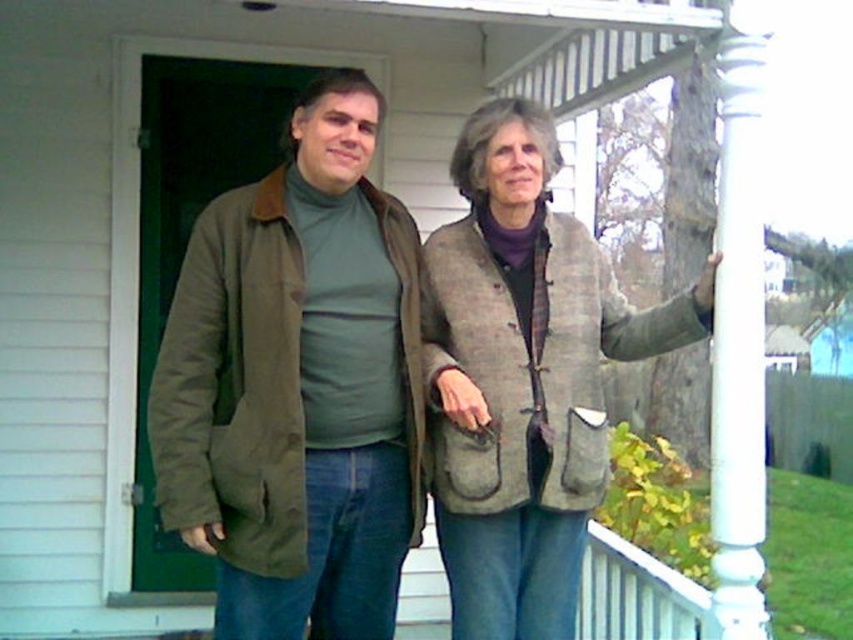
Between matte olive-green jacket at center and gray woolen vest at center, which one has less height?

With less height is gray woolen vest at center.

Who is more forward, (277, 624) or (563, 220)?

Positioned in front is point (277, 624).

The height and width of the screenshot is (640, 853). I want to click on matte olive-green jacket at center, so click(299, 385).

Between gray woolen vest at center and white glossy column at right, which one has less height?

gray woolen vest at center is shorter.

Who is taller, gray woolen vest at center or white glossy column at right?

white glossy column at right is taller.

The image size is (853, 640). I want to click on gray woolen vest at center, so click(x=524, y=376).

Can you confirm if matte olive-green jacket at center is positioned to the right of white glossy column at right?

Incorrect, matte olive-green jacket at center is not on the right side of white glossy column at right.

Which is behind, point (312, 115) or point (730, 113)?

The point (312, 115) is more distant.

Which is behind, point (350, 99) or point (722, 209)?

The point (350, 99) is behind.

Find the location of a particular element. matte olive-green jacket at center is located at coordinates (299, 385).